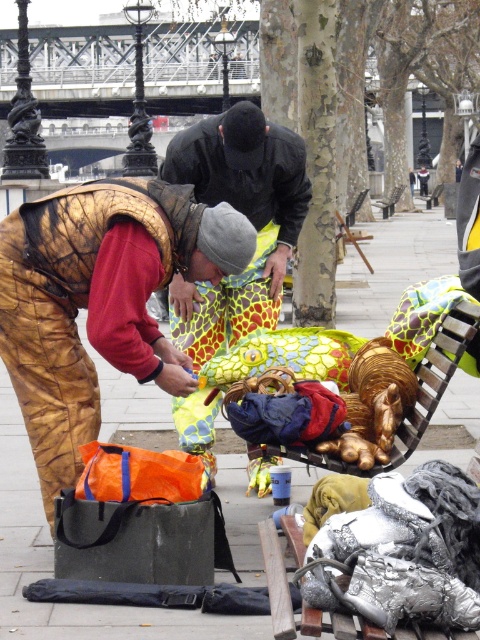
You are standing at the bridge in the background of the street scene. You notice two points of interest marked as point (x=197, y=355) and point (x=388, y=198). Which point is closer to you?

Point (x=197, y=355) is closer to the camera than point (x=388, y=198), so it is closer to you.

You are a pedestrian walking along the street and see the camouflage fabric street artist at left and the wooden bench at center. Which object is closer to the ground?

The camouflage fabric street artist at left is located below the wooden bench at center, so the camouflage fabric street artist at left is closer to the ground.